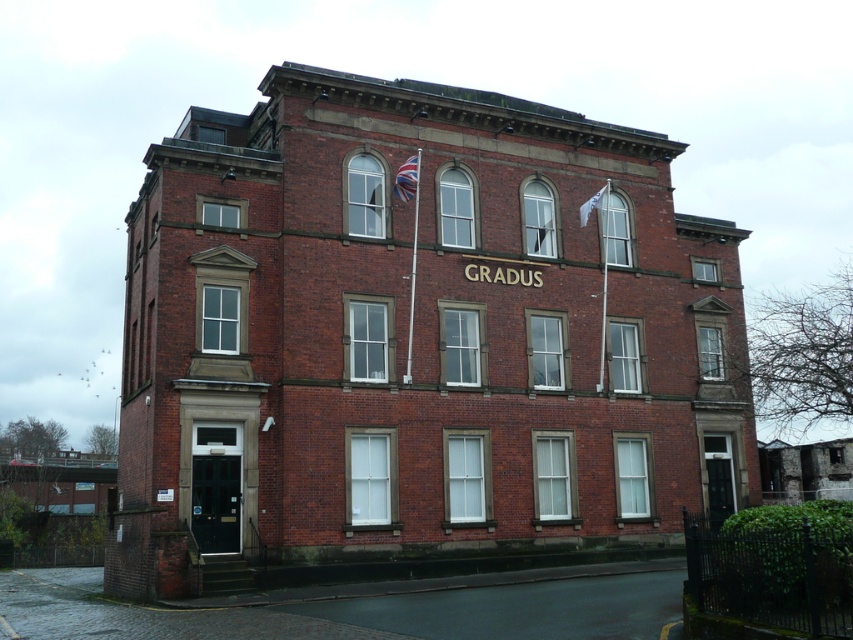
Does union jack fabric flag at upper center appear under white fabric flag at upper right?

No.

Between point (415, 193) and point (593, 204), which one is positioned in front?

Positioned in front is point (415, 193).

This screenshot has width=853, height=640. I want to click on union jack fabric flag at upper center, so click(405, 179).